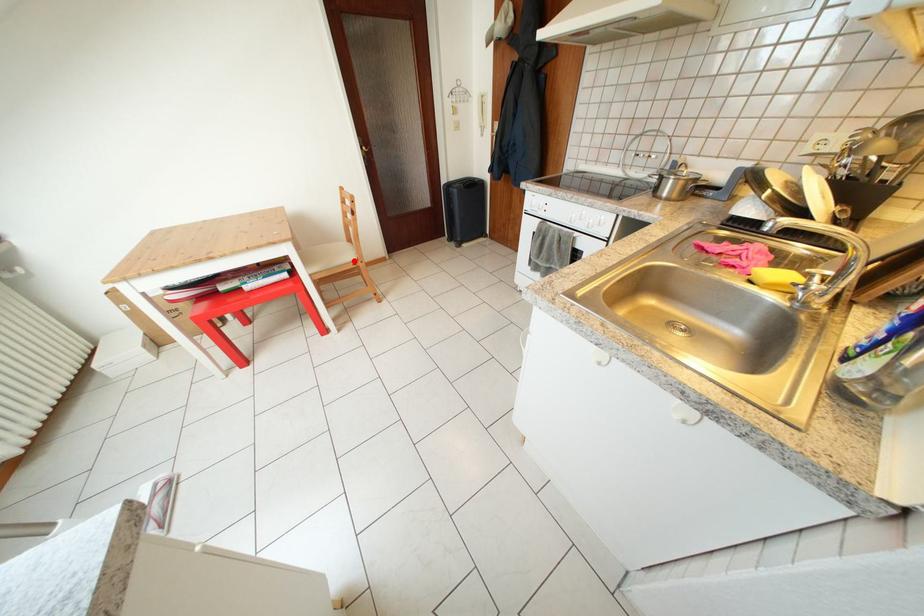
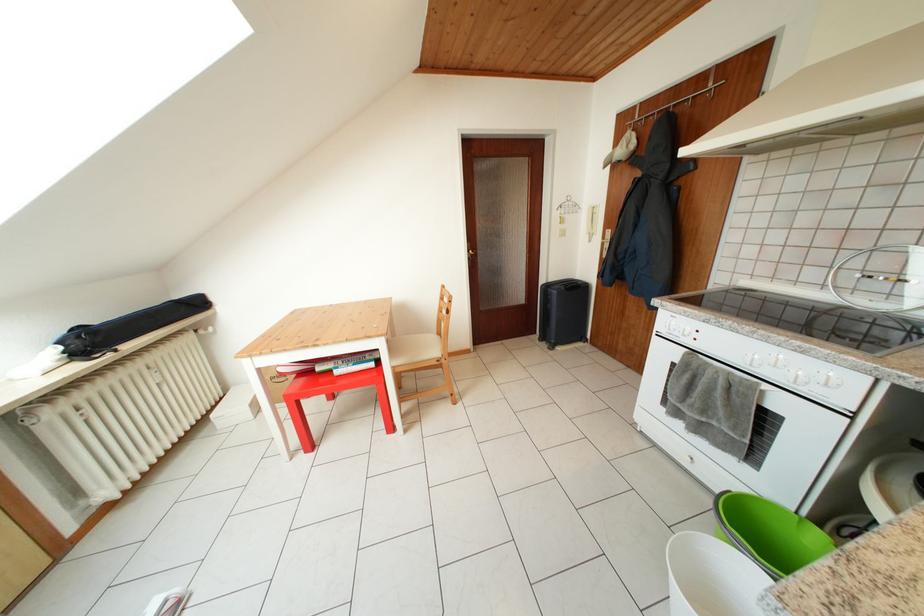
Question: I am providing you with two images of the same scene from different viewpoints. A red point is marked on the first image. Is the red point's position out of view in image 2?

Choices:
 (A) Yes
 (B) No

Answer: (B)